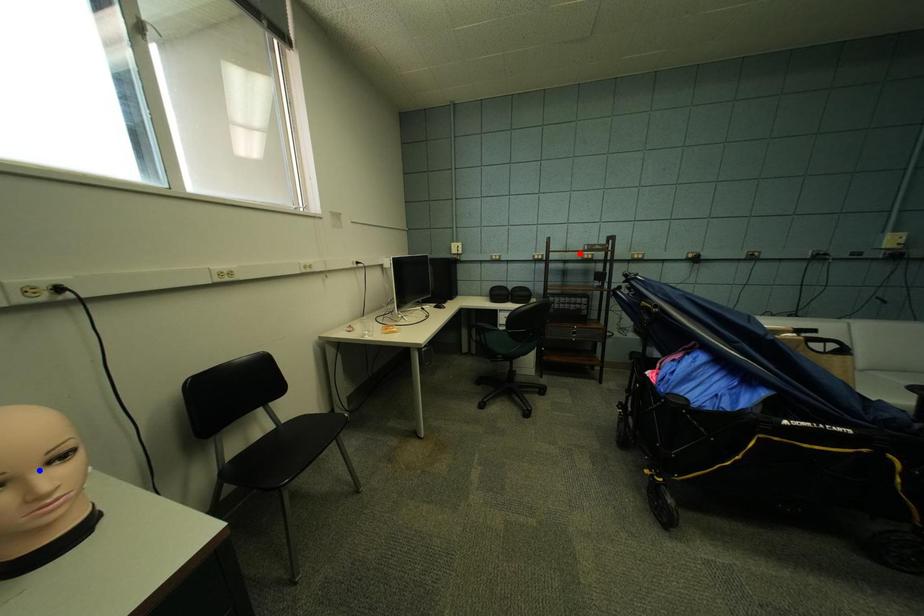
Question: Which of the two points in the image is closer to the camera?

Choices:
 (A) Blue point is closer.
 (B) Red point is closer.

Answer: (A)